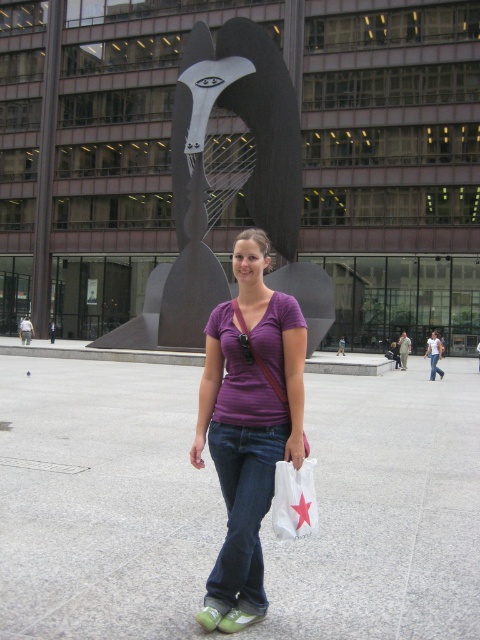
Does purple cotton shirt at center have a smaller size compared to white plastic bag at center?

Incorrect, purple cotton shirt at center is not smaller in size than white plastic bag at center.

Does purple cotton shirt at center lie behind white plastic bag at center?

Yes, purple cotton shirt at center is further from the viewer.

You are a GUI agent. You are given a task and a screenshot of the screen. Output one action in this format:
    pyautogui.click(x=<x>, y=<y>)
    Task: Click on the purple cotton shirt at center
    The height and width of the screenshot is (640, 480).
    Given the screenshot: What is the action you would take?
    pyautogui.click(x=249, y=424)

Identify the location of purple cotton shirt at center. The width and height of the screenshot is (480, 640). (249, 424).

Does white plastic bag at center have a larger size compared to purple fabric shirt at center?

No.

Which is more to the left, white plastic bag at center or purple fabric shirt at center?

From the viewer's perspective, white plastic bag at center appears more on the left side.

Which is in front, point (284, 486) or point (441, 342)?

Point (284, 486) is in front.

Where is `white plastic bag at center`? The width and height of the screenshot is (480, 640). white plastic bag at center is located at coordinates (294, 500).

Can you confirm if purple fabric shirt at center is taller than denim jeans at center?

Indeed, purple fabric shirt at center has a greater height compared to denim jeans at center.

Who is taller, purple fabric shirt at center or denim jeans at center?

purple fabric shirt at center

Which is behind, point (430, 352) or point (441, 372)?

The point (441, 372) is more distant.

Where is `purple fabric shirt at center`? The width and height of the screenshot is (480, 640). purple fabric shirt at center is located at coordinates (433, 355).